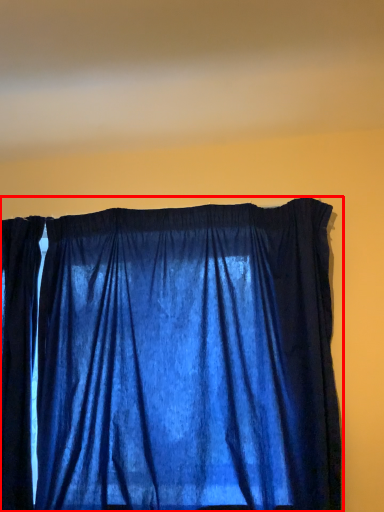
Question: Where is curtain (annotated by the red box) located in relation to blind in the image?

Choices:
 (A) right
 (B) left

Answer: (B)